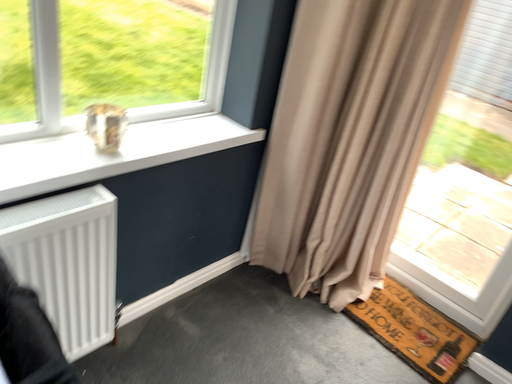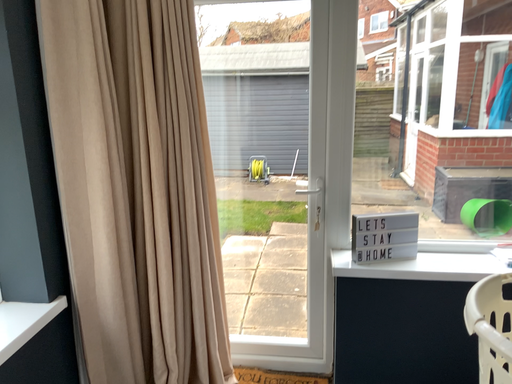
Question: Which way did the camera rotate in the video?

Choices:
 (A) rotated left
 (B) rotated right

Answer: (B)